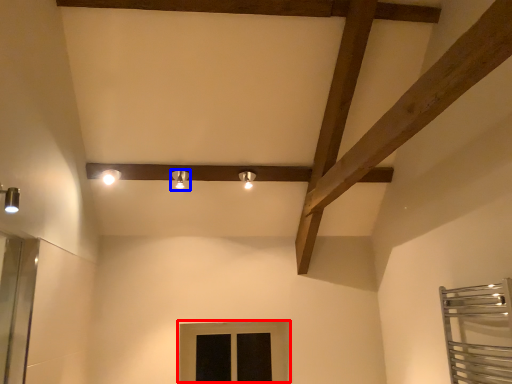
Question: Among these objects, which one is farthest to the camera, window (highlighted by a red box) or light fixture (highlighted by a blue box)?

Choices:
 (A) window
 (B) light fixture

Answer: (A)